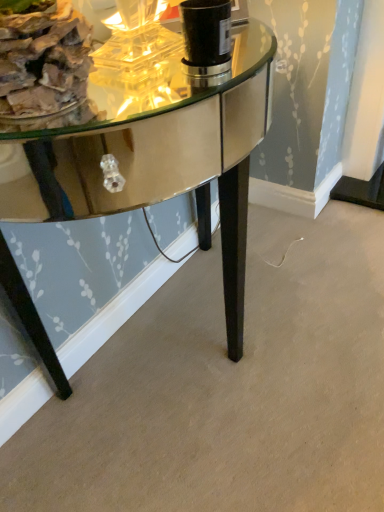
Locate an element on the screen. The height and width of the screenshot is (512, 384). wooden logs at left is located at coordinates (43, 59).

What do you see at coordinates (43, 59) in the screenshot?
I see `wooden logs at left` at bounding box center [43, 59].

Where is `shiny mirrored table at center`? This screenshot has width=384, height=512. shiny mirrored table at center is located at coordinates (161, 161).

What do you see at coordinates (161, 161) in the screenshot?
I see `shiny mirrored table at center` at bounding box center [161, 161].

This screenshot has height=512, width=384. Identify the location of wooden logs at left. (43, 59).

Considering the relative positions of shiny mirrored table at center and wooden logs at left in the image provided, is shiny mirrored table at center to the right of wooden logs at left from the viewer's perspective?

Yes.

Is shiny mirrored table at center behind wooden logs at left?

No, shiny mirrored table at center is in front of wooden logs at left.

Which is farther, (204,150) or (8,89)?

The point (204,150) is more distant.

In the scene shown: From the image's perspective, between shiny mirrored table at center and wooden logs at left, who is located below?

From the image's view, shiny mirrored table at center is below.

From a real-world perspective, is shiny mirrored table at center physically above wooden logs at left?

No, from a real-world perspective, shiny mirrored table at center is not over wooden logs at left

Between shiny mirrored table at center and wooden logs at left, which one has larger width?

With larger width is shiny mirrored table at center.

Considering the sizes of objects shiny mirrored table at center and wooden logs at left in the image provided, who is shorter, shiny mirrored table at center or wooden logs at left?

With less height is wooden logs at left.

Based on the photo, who is bigger, shiny mirrored table at center or wooden logs at left?

shiny mirrored table at center is bigger.

From the picture: Could wooden logs at left be considered to be inside shiny mirrored table at center?

Definitely not — wooden logs at left is not inside shiny mirrored table at center.

Are shiny mirrored table at center and wooden logs at left beside each other?

shiny mirrored table at center and wooden logs at left are clearly separated.

Is shiny mirrored table at center facing away from wooden logs at left?

No.

How many degrees apart are the facing directions of shiny mirrored table at center and wooden logs at left?

They differ by 2.55 degrees in their facing directions.

Identify the location of table in front of the wooden logs at left. Image resolution: width=384 pixels, height=512 pixels. (161, 161).

Which is more to the left, wooden logs at left or shiny mirrored table at center?

From the viewer's perspective, wooden logs at left appears more on the left side.

Relative to shiny mirrored table at center, is wooden logs at left in front or behind?

In the image, wooden logs at left appears behind shiny mirrored table at center.

Which is nearer, (70,65) or (211,118)?

Positioned in front is point (70,65).

From the image's perspective, between wooden logs at left and shiny mirrored table at center, which one is located above?

wooden logs at left is shown above in the image.

From a real-world perspective, is wooden logs at left physically above shiny mirrored table at center?

Yes, from a real-world perspective, wooden logs at left is on top of shiny mirrored table at center.

Which object is thinner, wooden logs at left or shiny mirrored table at center?

wooden logs at left is thinner.

Is wooden logs at left shorter than shiny mirrored table at center?

Yes, wooden logs at left is shorter than shiny mirrored table at center.

Considering the relative sizes of wooden logs at left and shiny mirrored table at center in the image provided, is wooden logs at left bigger than shiny mirrored table at center?

Incorrect, wooden logs at left is not larger than shiny mirrored table at center.

Is wooden logs at left spatially inside shiny mirrored table at center, or outside of it?

The correct answer is: outside.

Is wooden logs at left far from shiny mirrored table at center?

No.

Is wooden logs at left positioned with its back to shiny mirrored table at center?

No.

How different are the orientations of wooden logs at left and shiny mirrored table at center in degrees?

The angle between the facing direction of wooden logs at left and the facing direction of shiny mirrored table at center is 2.55 degrees.

Where is `table located below the wooden logs at left (from the image's perspective)`? The width and height of the screenshot is (384, 512). table located below the wooden logs at left (from the image's perspective) is located at coordinates (161, 161).

Find the location of a particular element. Image resolution: width=384 pixels, height=512 pixels. table that is on the right side of wooden logs at left is located at coordinates (161, 161).

Image resolution: width=384 pixels, height=512 pixels. Identify the location of table that appears in front of the wooden logs at left. coord(161,161).